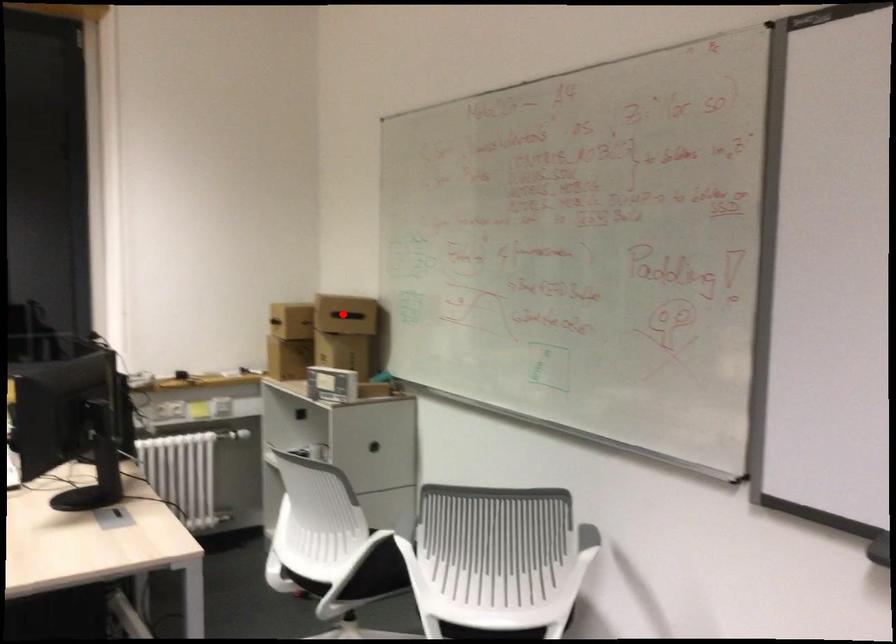
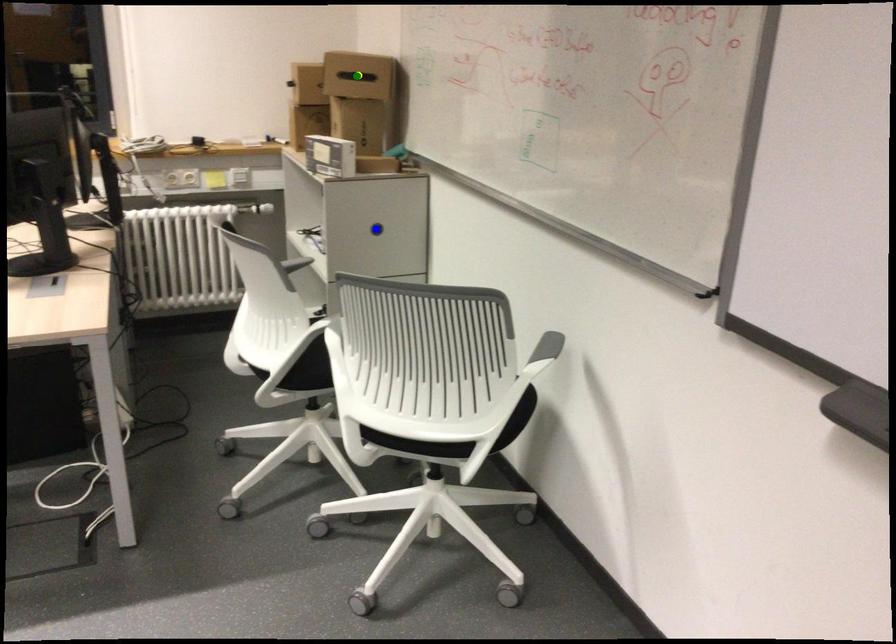
Question: I am providing you with two images of the same scene from different viewpoints. A red point is marked on the first image. You are given multiple points on the second image. Which mark in image 2 goes with the point in image 1?

Choices:
 (A) blue point
 (B) yellow point
 (C) green point

Answer: (C)